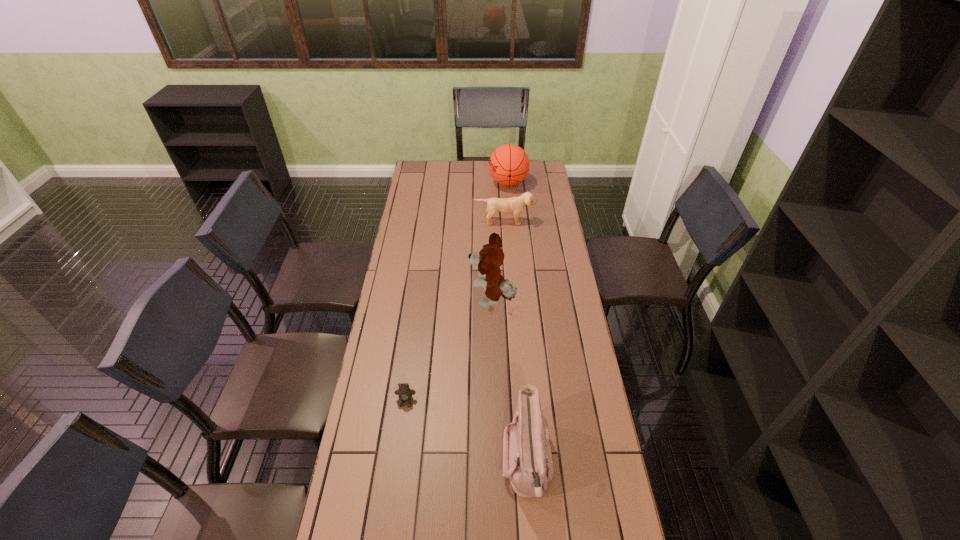
Locate an element on the screen. free space in the image that satisfies the following two spatial constraints: 1. on the side with logo of the basketball; 2. on the left side of the shorter puppy is located at coordinates (512, 221).